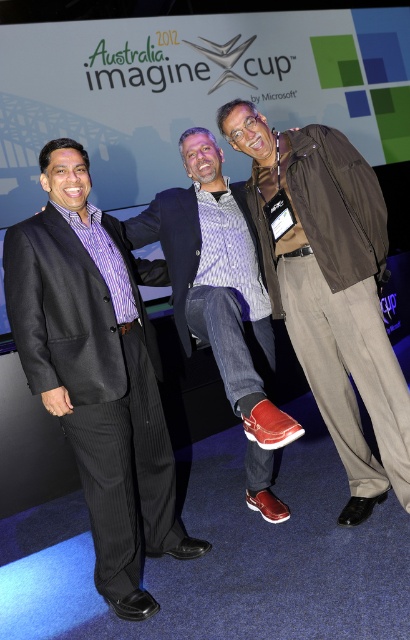
In order to click on brown leather jacket at center in this screenshot , I will do `click(332, 291)`.

Between point (309, 369) and point (243, 205), which one is positioned behind?

Positioned behind is point (243, 205).

Who is more forward, [387,387] or [218,330]?

Point [218,330] is more forward.

Identify the location of brown leather jacket at center. The width and height of the screenshot is (410, 640). (332, 291).

Consider the image. Is black pinstripe suit at left bigger than matte black blazer at center?

No.

What do you see at coordinates (97, 387) in the screenshot?
I see `black pinstripe suit at left` at bounding box center [97, 387].

Measure the distance between black pinstripe suit at left and camera.

black pinstripe suit at left is 1.86 meters away from camera.

Where is `black pinstripe suit at left`? black pinstripe suit at left is located at coordinates (97, 387).

Does brown leather jacket at center appear over black pinstripe suit at left?

Yes, brown leather jacket at center is above black pinstripe suit at left.

Which of these two, brown leather jacket at center or black pinstripe suit at left, stands shorter?

Standing shorter between the two is black pinstripe suit at left.

Between point (302, 324) and point (155, 259), which one is positioned in front?

Point (302, 324) is more forward.

The width and height of the screenshot is (410, 640). Identify the location of brown leather jacket at center. (332, 291).